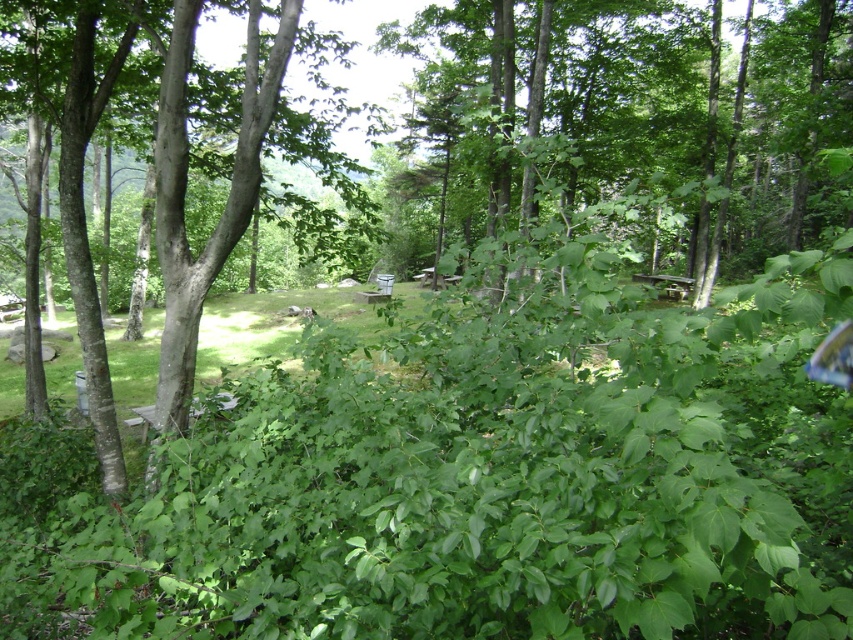
You are planning to set up a tent in the forest clearing. The green leafy tree at center and the smooth bark tree at center are both in the area. Which tree would provide more shade for your tent?

The green leafy tree at center has a larger size compared to the smooth bark tree at center, so it would provide more shade for your tent.

You are planning to set up a tent in the clearing. The green leafy tree at center and the smooth bark tree at center are both in the area. Which tree would provide more shade over the tent during midday?

The green leafy tree at center is positioned over the smooth bark tree at center, so it would provide more shade over the tent during midday.